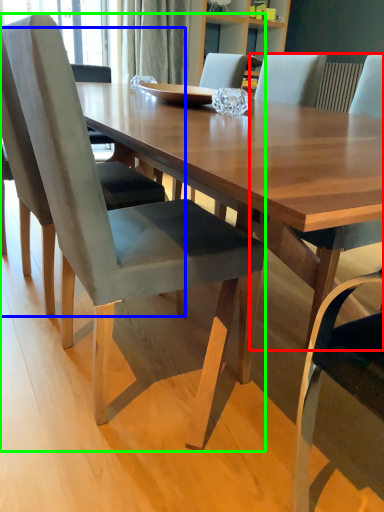
Question: Estimate the real-world distances between objects in this image. Which object is farther from chair (highlighted by a red box), chair (highlighted by a blue box) or chair (highlighted by a green box)?

Choices:
 (A) chair
 (B) chair

Answer: (A)